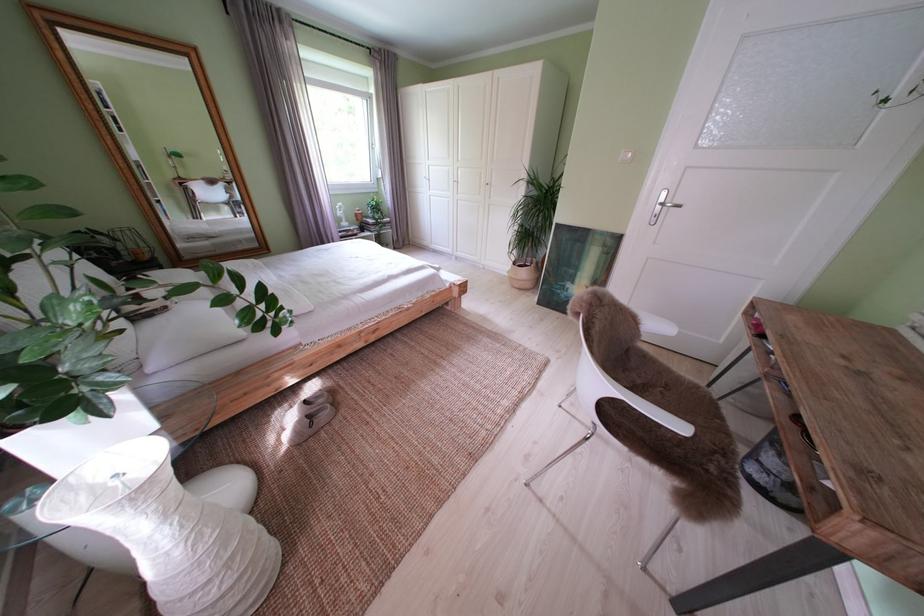
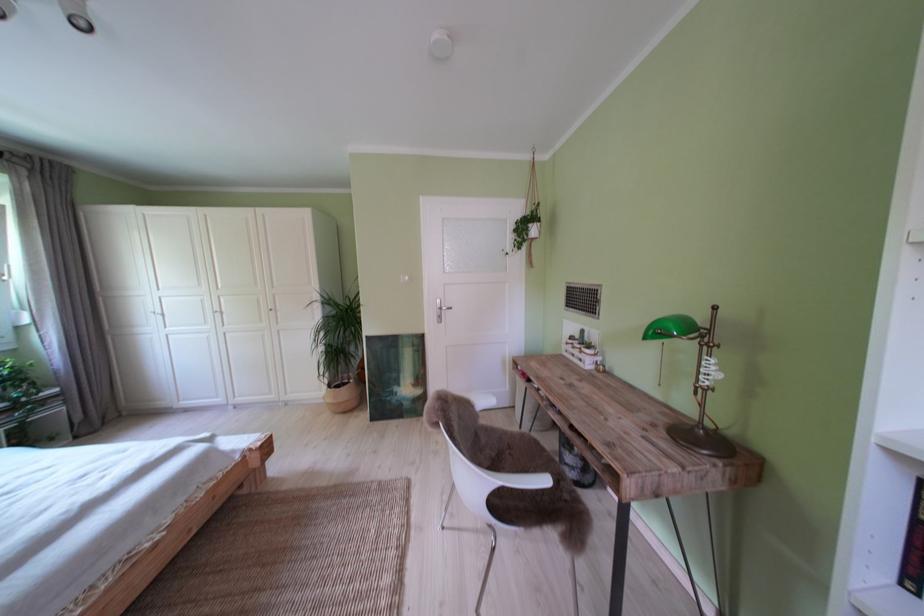
In the second image, find the point that corresponds to [673,398] in the first image.

(521, 459)